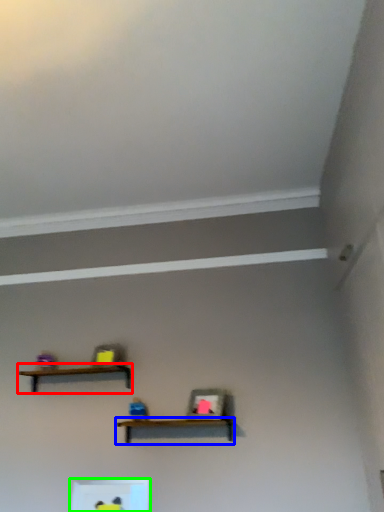
Question: Which object is the closest to the shelf (highlighted by a red box)? Choose among these: shelf (highlighted by a blue box) or shelf (highlighted by a green box).

Choices:
 (A) shelf
 (B) shelf

Answer: (A)